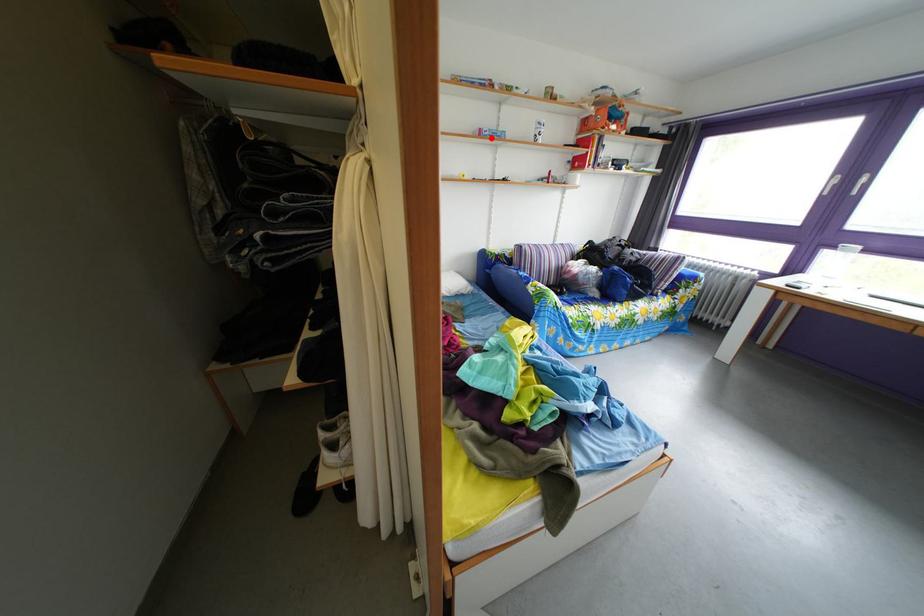
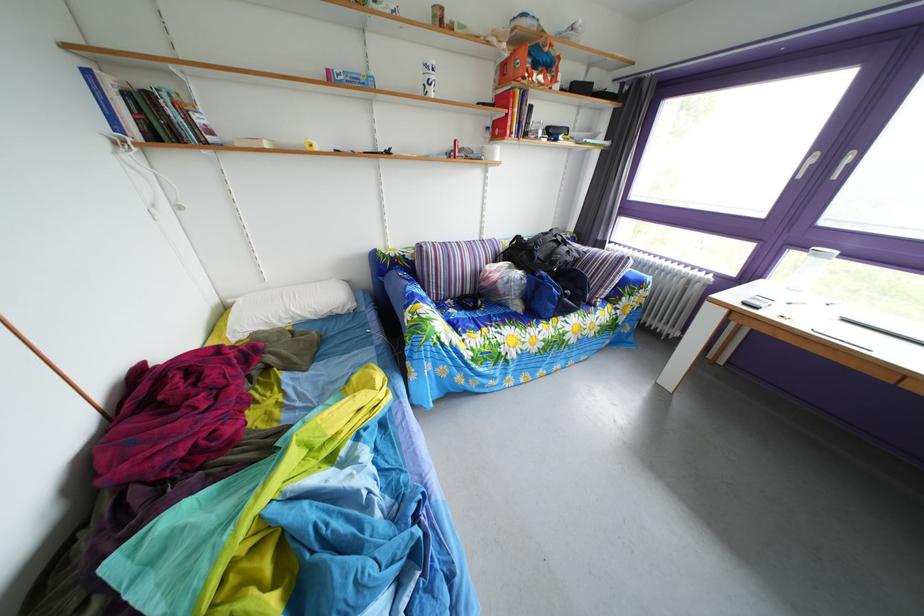
Locate, in the second image, the point that corresponds to the highlighted location in the first image.

(339, 79)